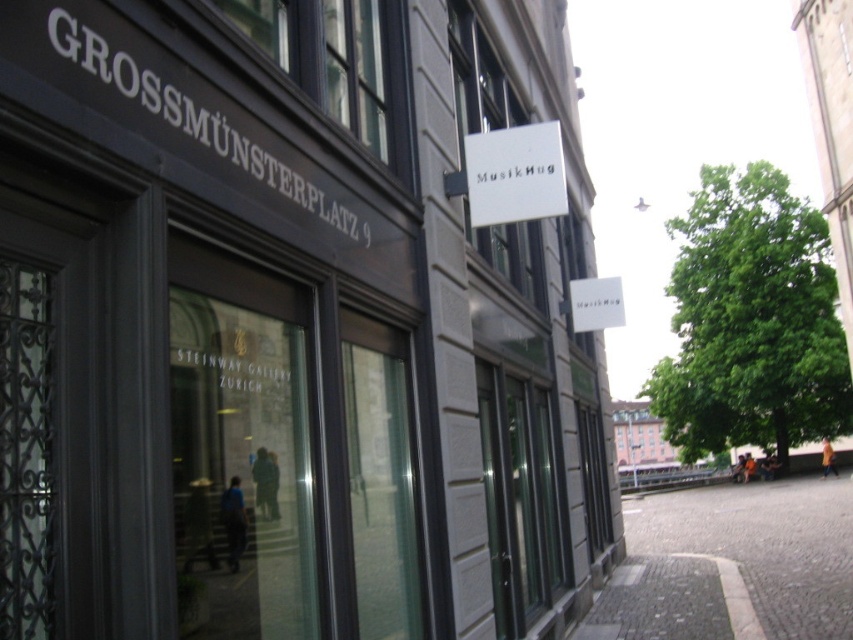
Between matte gray building at center and gray cobblestone pavement at lower right, which one appears on the right side from the viewer's perspective?

gray cobblestone pavement at lower right

Locate an element on the screen. matte gray building at center is located at coordinates (296, 323).